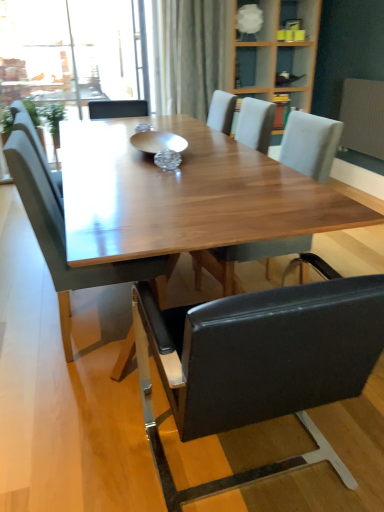
The height and width of the screenshot is (512, 384). What are the coordinates of `vacant point to the left of matte gray chair at left, which appears as the 3th chair when viewed from the right` in the screenshot? It's located at (x=23, y=331).